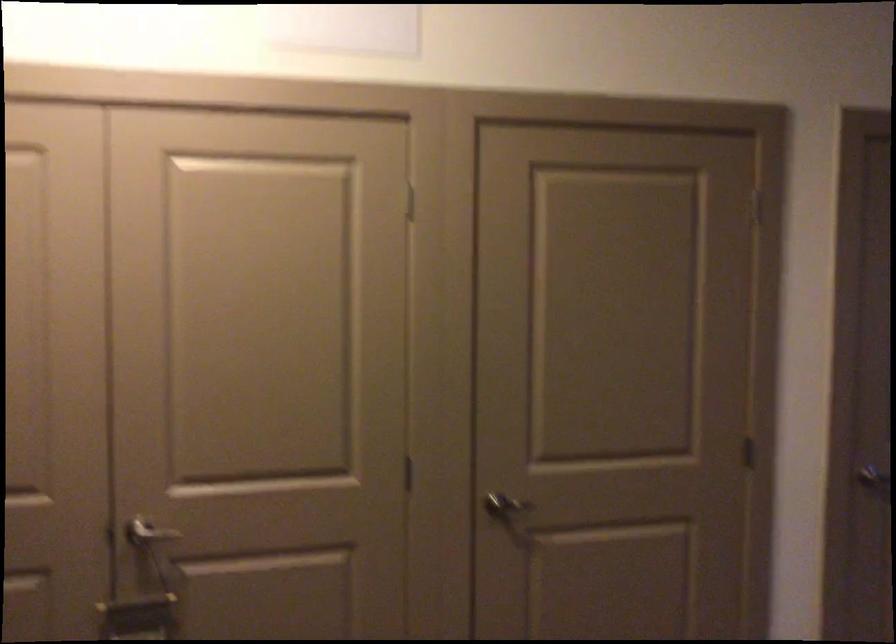
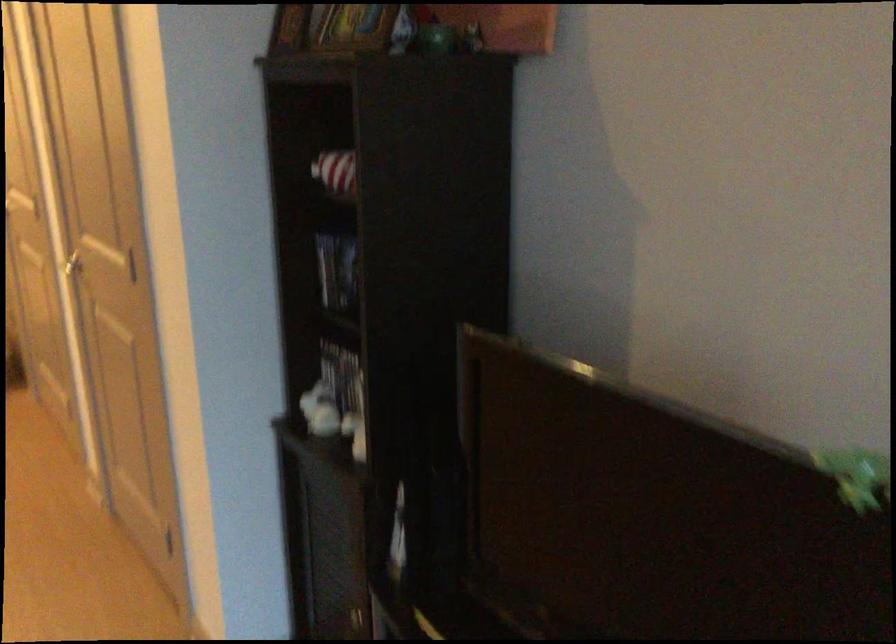
The point at (x=772, y=485) is marked in the first image. Where is the corresponding point in the second image?

(73, 267)